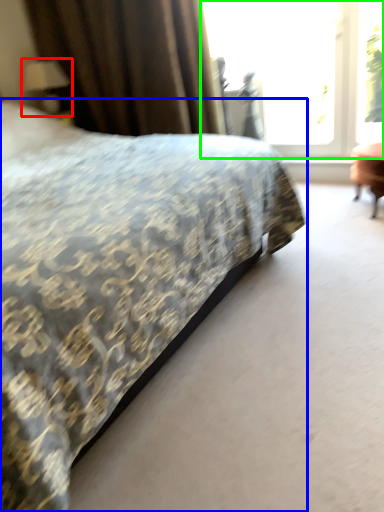
Question: Which object is the closest to the table lamp (highlighted by a red box)? Choose among these: bed (highlighted by a blue box) or window (highlighted by a green box).

Choices:
 (A) bed
 (B) window

Answer: (B)